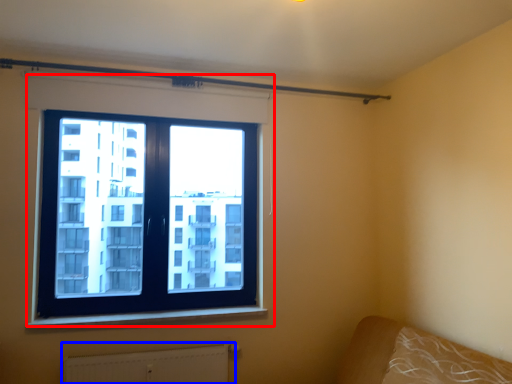
Question: Which of the following is the farthest to the observer, window (highlighted by a red box) or radiator (highlighted by a blue box)?

Choices:
 (A) window
 (B) radiator

Answer: (A)